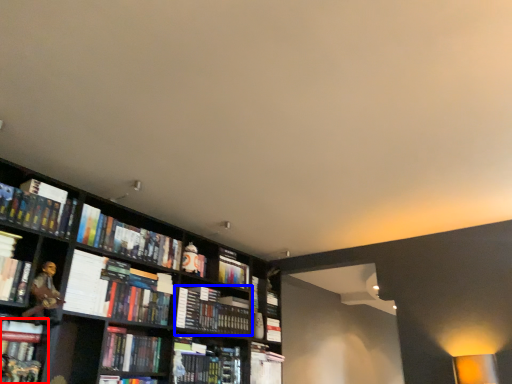
Question: Which of the following is the closest to the observer, book (highlighted by a red box) or book (highlighted by a blue box)?

Choices:
 (A) book
 (B) book

Answer: (A)